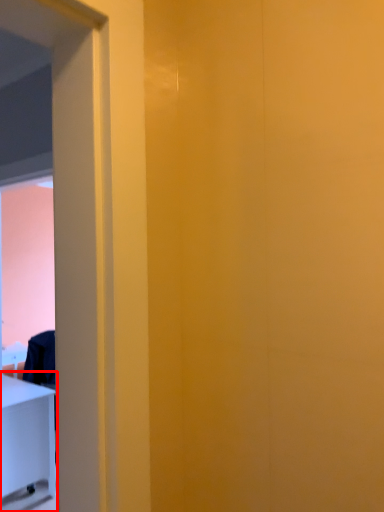
Question: From the image, what is the correct spatial relationship of furniture (annotated by the red box) in relation to screen door?

Choices:
 (A) right
 (B) left

Answer: (B)